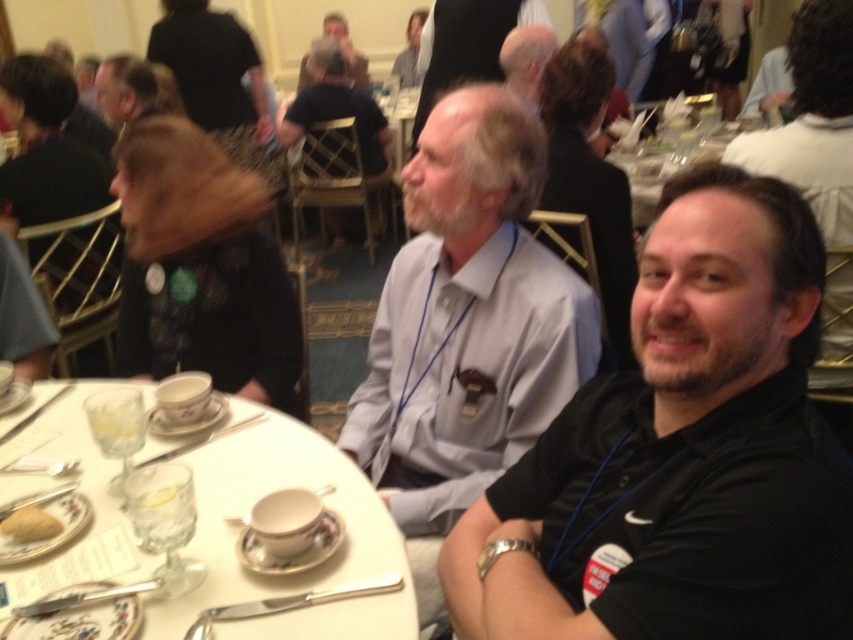
You are planning to place a rectangular placemat that is 12 inches wide on the table. Given the light blue shirt at center and the white porcelain table at center, which object has a smaller width, and will the placemat fit on the table?

The light blue shirt at center has a smaller width compared to the white porcelain table at center. Since the placemat is 12 inches wide, it will fit on the white porcelain table at center as the table is wider than the placemat.

You are standing at the entrance of the banquet hall and see two points marked in the image. Which point, point [462,484] or point [734,132], is closer to you?

Point [462,484] is closer to the camera than point [734,132], so it is closer to you.